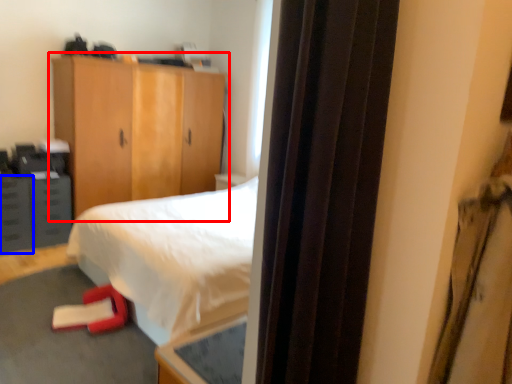
Question: Which of the following is the closest to the observer, cupboard (highlighted by a red box) or drawer (highlighted by a blue box)?

Choices:
 (A) cupboard
 (B) drawer

Answer: (B)